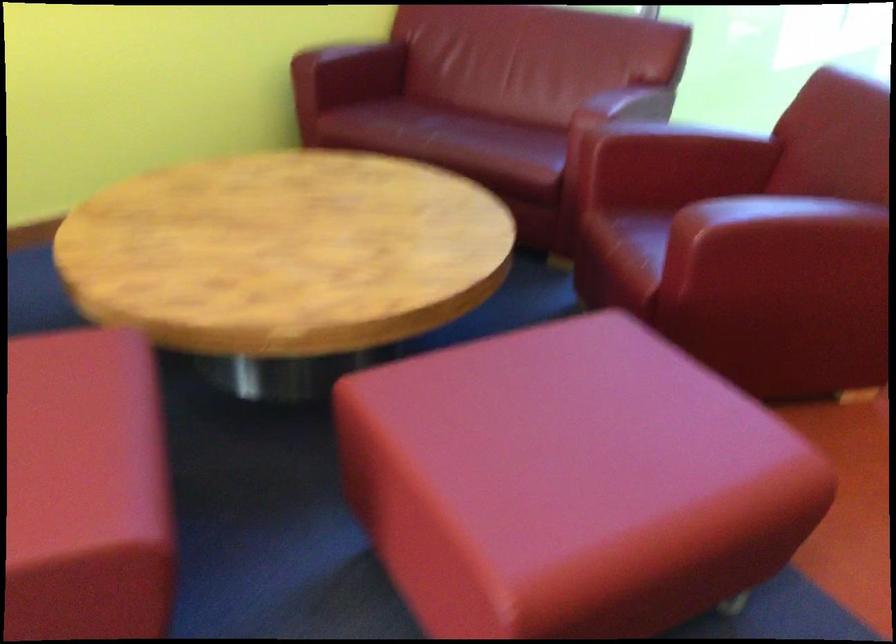
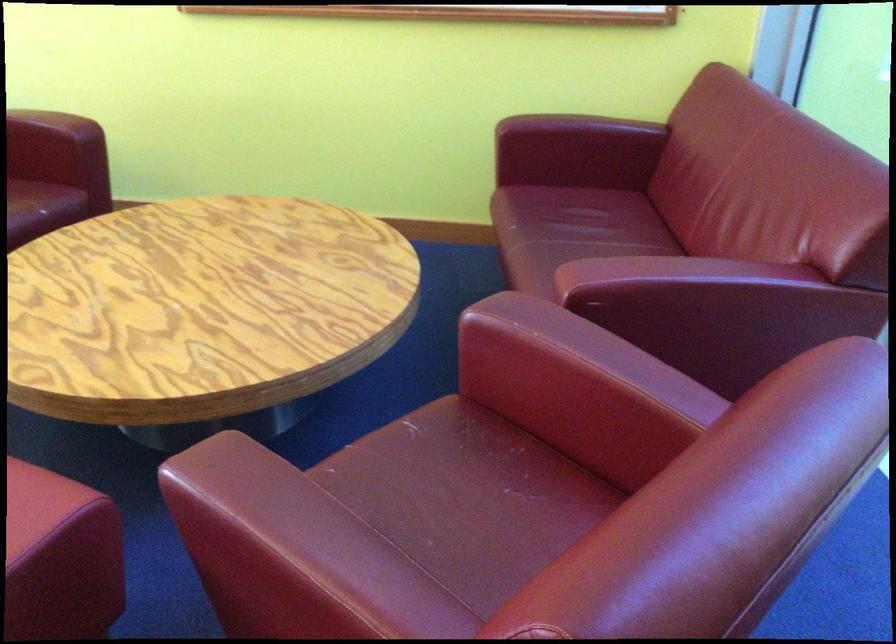
In the second image, find the point that corresponds to (x=648, y=124) in the first image.

(540, 319)